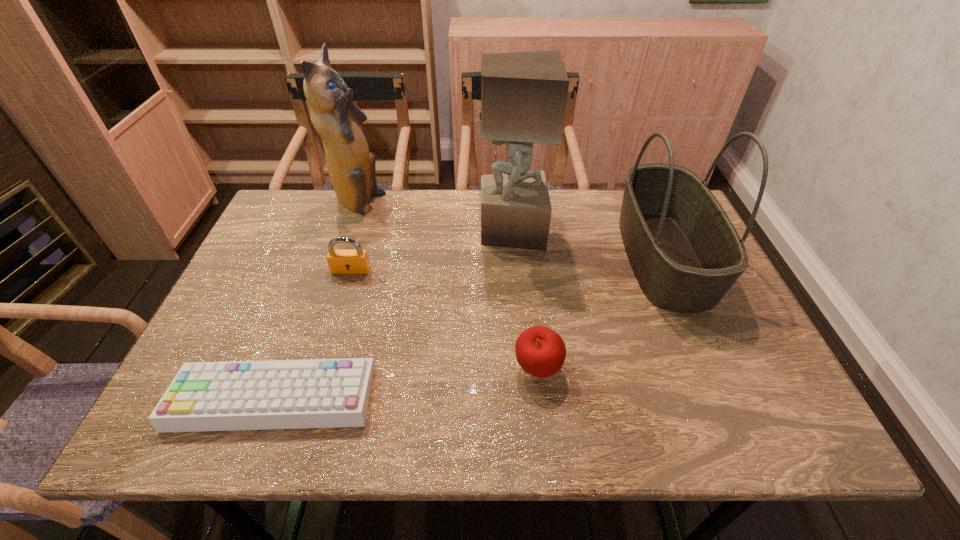
At what (x,y) coordinates should I click in order to perform the action: click on sculpture. Please return your answer as a coordinate pair (x, y). Image resolution: width=960 pixels, height=540 pixels. Looking at the image, I should click on (523, 94).

Locate an element on the screen. cat is located at coordinates (351, 167).

At what (x,y) coordinates should I click in order to perform the action: click on the rightmost object. Please return your answer as a coordinate pair (x, y). This screenshot has height=540, width=960. Looking at the image, I should click on (686, 254).

At what (x,y) coordinates should I click in order to perform the action: click on the fourth shortest object. Please return your answer as a coordinate pair (x, y). This screenshot has height=540, width=960. Looking at the image, I should click on pyautogui.click(x=686, y=254).

The image size is (960, 540). In order to click on padlock in this screenshot , I will do `click(340, 261)`.

Where is `apple`? apple is located at coordinates (540, 351).

You are a GUI agent. You are given a task and a screenshot of the screen. Output one action in this format:
    pyautogui.click(x=<x>, y=<y>)
    Task: Click on the computer keyboard
    This screenshot has height=540, width=960.
    Given the screenshot: What is the action you would take?
    pyautogui.click(x=315, y=393)

This screenshot has width=960, height=540. I want to click on vacant space located on the front-facing side of the sculpture, so click(x=403, y=230).

You are a GUI agent. You are given a task and a screenshot of the screen. Output one action in this format:
    pyautogui.click(x=<x>, y=<y>)
    Task: Click on the vacant space situated 0.100m on the front-facing side of the sculpture
    This screenshot has width=960, height=540.
    Given the screenshot: What is the action you would take?
    (x=444, y=230)

Identify the location of vacant space located on the front-facing side of the sculpture. (417, 230).